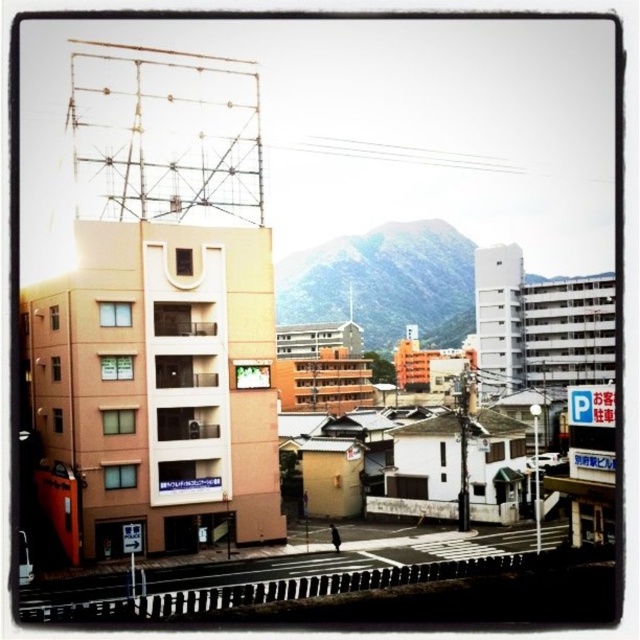
Does point (296, 292) come closer to viewer compared to point (61, 612)?

No, (296, 292) is behind (61, 612).

This screenshot has width=640, height=640. I want to click on green matte mountain at center, so click(385, 282).